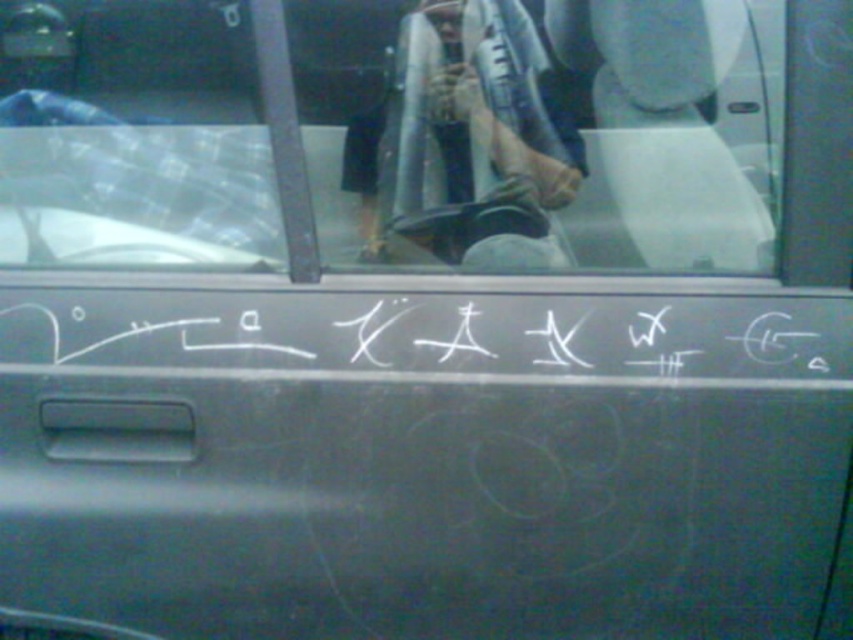
Does transparent glass windshield at upper center have a greater width compared to white chalk writing at center?

Incorrect, transparent glass windshield at upper center's width does not surpass white chalk writing at center's.

Does transparent glass windshield at upper center have a larger size compared to white chalk writing at center?

Yes, transparent glass windshield at upper center is bigger than white chalk writing at center.

Where is `transparent glass windshield at upper center`? The width and height of the screenshot is (853, 640). transparent glass windshield at upper center is located at coordinates (541, 128).